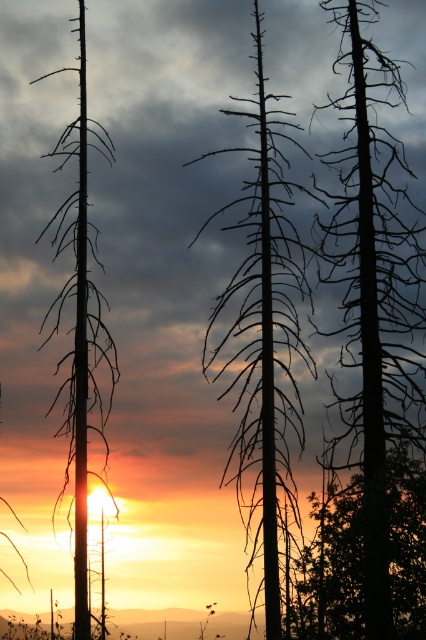
You are standing in the scene and want to take a photo of the black deadwood tree at center. According to the coordinates provided, where should you position your camera to capture it in the frame?

The black deadwood tree at center is located at coordinates point [374,296], so position your camera there to capture it.

You are an artist sketching this sunset scene. You want to ensure the black deadwood tree at center and the silhouette deadwood at left are positioned correctly relative to each other. According to the scene, which one should be drawn higher up?

The black deadwood tree at center should be drawn higher up because it is located above the silhouette deadwood at left.

You are an artist trying to paint the sunset scene. You want to ensure the silhouette bark tree at center is visible in your painting. Since the black deadwood tree at center is blocking part of it, how should you position them?

The silhouette bark tree at center is behind the black deadwood tree at center, so you should paint the black deadwood tree at center in front to partially obscure the silhouette bark tree at center, ensuring the latter remains visible through the gaps in the branches.